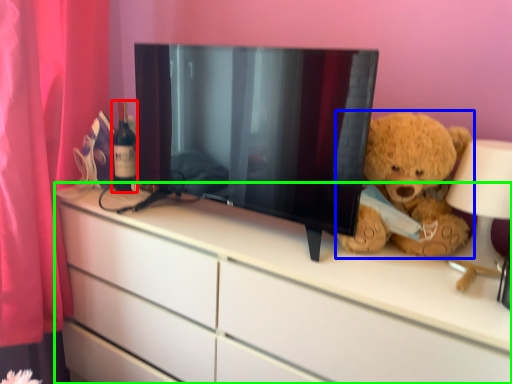
Question: Estimate the real-world distances between objects in this image. Which object is closer to bottle (highlighted by a red box), teddy bear (highlighted by a blue box) or chest of drawers (highlighted by a green box)?

Choices:
 (A) teddy bear
 (B) chest of drawers

Answer: (B)